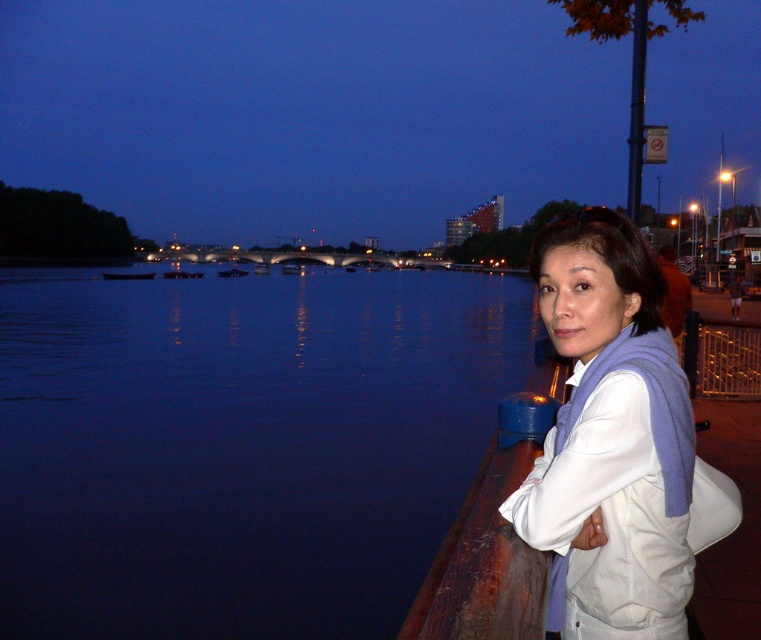
You are a photographer trying to capture both the dark blue wooden boat at center and the metallic silver boat at center in a single frame. Which boat should you position closer to the camera to ensure both are fully visible without cropping?

Since the dark blue wooden boat at center is shorter than the metallic silver boat at center, positioning the shorter dark blue wooden boat at center closer to the camera will help keep both boats within the frame without cropping.

From the picture: You are a photographer trying to capture the dark blue wooden boat at center and the metallic silver boat at center in the same frame. Which boat will appear closer to the camera in the photo?

The dark blue wooden boat at center will appear closer to the camera because it is positioned in front of the metallic silver boat at center.

You are a photographer trying to capture the blue water at lower left in the image. Based on its coordinates, where should you position your camera to ensure it is centered in the frame?

The blue water at lower left is located at coordinates point (x=240, y=445), so you should position your camera to center the blue water at lower left at that point.